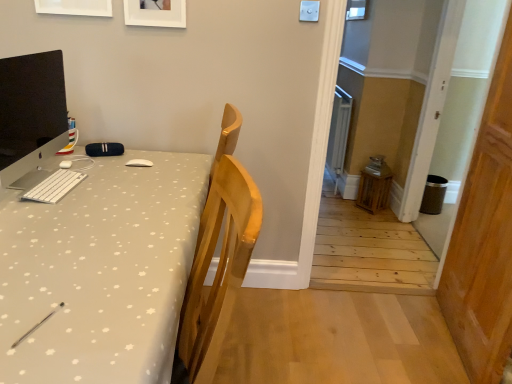
You are a GUI agent. You are given a task and a screenshot of the screen. Output one action in this format:
    pyautogui.click(x=<x>, y=<y>)
    Task: Click on the white matte keyboard at left
    This screenshot has height=384, width=512.
    Given the screenshot: What is the action you would take?
    pyautogui.click(x=54, y=186)

What do you see at coordinates (484, 238) in the screenshot? I see `wooden door at right` at bounding box center [484, 238].

What are the coordinates of `wooden door at right` in the screenshot? It's located at (484, 238).

The width and height of the screenshot is (512, 384). Identify the location of matte black monitor at left. (30, 111).

This screenshot has height=384, width=512. What do you see at coordinates (155, 13) in the screenshot?
I see `white matte picture frame at upper center, which is counted as the first picture frame, starting from the right` at bounding box center [155, 13].

Locate an element on the screen. white fabric desk at left is located at coordinates point(101,272).

This screenshot has width=512, height=384. I want to click on white matte picture frame at upper center, the first picture frame from the left, so click(75, 7).

Is matte black monitor at left located outside white matte picture frame at upper center, arranged as the second picture frame when viewed from the right?

Yes.

Between matte black monitor at left and white matte picture frame at upper center, arranged as the second picture frame when viewed from the right, which one is positioned behind?

white matte picture frame at upper center, arranged as the second picture frame when viewed from the right.

Which point is more distant from viewer, [6,75] or [95,3]?

The point [95,3] is farther from the camera.

Would you say matte black monitor at left is to the left or to the right of white matte picture frame at upper center, arranged as the second picture frame when viewed from the right, in the picture?

Based on their positions, matte black monitor at left is located to the left of white matte picture frame at upper center, arranged as the second picture frame when viewed from the right.

How many degrees apart are the facing directions of matte black monitor at left and white fabric desk at left?

Result: The angular difference between matte black monitor at left and white fabric desk at left is 90 degrees.

This screenshot has width=512, height=384. Find the location of `computer monitor lying behind the white fabric desk at left`. computer monitor lying behind the white fabric desk at left is located at coordinates (30, 111).

From a real-world perspective, between matte black monitor at left and white fabric desk at left, who is vertically higher?

matte black monitor at left is physically above.

Does point (33, 148) come farther from viewer compared to point (64, 212)?

Yes, point (33, 148) is farther from viewer.

Considering the sizes of objects white matte picture frame at upper center, which is counted as the first picture frame, starting from the right, and matte black monitor at left in the image provided, who is smaller, white matte picture frame at upper center, which is counted as the first picture frame, starting from the right, or matte black monitor at left?

With smaller size is white matte picture frame at upper center, which is counted as the first picture frame, starting from the right.

From the image's perspective, is white matte picture frame at upper center, which appears as the 2th picture frame when viewed from the left, located above or below matte black monitor at left?

From the image's perspective, white matte picture frame at upper center, which appears as the 2th picture frame when viewed from the left, appears above matte black monitor at left.

What's the angular difference between white matte picture frame at upper center, which appears as the 2th picture frame when viewed from the left, and matte black monitor at left's facing directions?

white matte picture frame at upper center, which appears as the 2th picture frame when viewed from the left, and matte black monitor at left are facing 90 degrees away from each other.

Does white matte keyboard at left have a greater width compared to wooden door at right?

No.

Is point (62, 175) positioned after point (473, 172)?

No, it is in front of (473, 172).

Which of these two, white matte keyboard at left or wooden door at right, is smaller?

Smaller between the two is white matte keyboard at left.

Relative to wooden door at right, is white matte keyboard at left in front or behind?

Clearly, white matte keyboard at left is behind wooden door at right.

Identify the location of the 2nd picture frame counting from the left of the wooden door at right. Image resolution: width=512 pixels, height=384 pixels. (75, 7).

Which is closer, [463,360] or [98,4]?

The point [98,4] is in front.

From the image's perspective, is wooden door at right beneath white matte picture frame at upper center, the first picture frame from the left?

Correct, wooden door at right appears lower than white matte picture frame at upper center, the first picture frame from the left, in the image.

Based on their positions, is white matte picture frame at upper center, arranged as the second picture frame when viewed from the right, located to the left or right of white matte keyboard at left?

Clearly, white matte picture frame at upper center, arranged as the second picture frame when viewed from the right, is on the left of white matte keyboard at left in the image.

Is white matte picture frame at upper center, the first picture frame from the left, closer to camera compared to white matte keyboard at left?

No, the depth of white matte picture frame at upper center, the first picture frame from the left, is greater than that of white matte keyboard at left.

From a real-world perspective, which is physically above, white matte picture frame at upper center, the first picture frame from the left, or white matte keyboard at left?

white matte picture frame at upper center, the first picture frame from the left.

Is white fabric desk at left wider than white matte keyboard at left?

Yes.

Locate an element on the screen. The image size is (512, 384). keyboard above the white fabric desk at left (from a real-world perspective) is located at coordinates (54, 186).

From the image's perspective, starting from the matte black monitor at left, which picture frame is the 2nd one above? Please provide its 2D coordinates.

[(75, 7)]

Where is `desk that appears on the right of matte black monitor at left`? The width and height of the screenshot is (512, 384). desk that appears on the right of matte black monitor at left is located at coordinates (101, 272).

Looking at the image, which one is located closer to matte black monitor at left, white matte picture frame at upper center, which appears as the 2th picture frame when viewed from the left, or wooden door at right?

Among the two, white matte picture frame at upper center, which appears as the 2th picture frame when viewed from the left, is located nearer to matte black monitor at left.

When comparing their distances from white matte picture frame at upper center, the first picture frame from the left, does white fabric desk at left or matte black monitor at left seem closer?

matte black monitor at left is closer to white matte picture frame at upper center, the first picture frame from the left.

Considering their positions, is matte black monitor at left positioned further to white matte picture frame at upper center, which appears as the 2th picture frame when viewed from the left, than white matte keyboard at left?

white matte keyboard at left is positioned further to the anchor white matte picture frame at upper center, which appears as the 2th picture frame when viewed from the left.

Which object lies nearer to the anchor point white matte keyboard at left, white matte picture frame at upper center, the first picture frame from the left, or matte black monitor at left?

Among the two, matte black monitor at left is located nearer to white matte keyboard at left.

Which object lies nearer to the anchor point white matte picture frame at upper center, arranged as the second picture frame when viewed from the right, white fabric desk at left or wooden door at right?

white fabric desk at left.

Based on their spatial positions, is white matte picture frame at upper center, which appears as the 2th picture frame when viewed from the left, or wooden door at right further from white matte keyboard at left?

The object further to white matte keyboard at left is wooden door at right.

Which object lies further to the anchor point wooden door at right, matte black monitor at left or white matte picture frame at upper center, arranged as the second picture frame when viewed from the right?

Among the two, white matte picture frame at upper center, arranged as the second picture frame when viewed from the right, is located further to wooden door at right.

Which object lies nearer to the anchor point white matte keyboard at left, white fabric desk at left or white matte picture frame at upper center, which appears as the 2th picture frame when viewed from the left?

The object closer to white matte keyboard at left is white fabric desk at left.

Identify the location of picture frame between white matte picture frame at upper center, the first picture frame from the left, and white fabric desk at left from top to bottom. (155, 13).

Where is `picture frame situated between white fabric desk at left and wooden door at right from left to right`? The image size is (512, 384). picture frame situated between white fabric desk at left and wooden door at right from left to right is located at coordinates (155, 13).

Find the location of a particular element. Image resolution: width=512 pixels, height=384 pixels. desk between white matte picture frame at upper center, arranged as the second picture frame when viewed from the right, and wooden door at right is located at coordinates (101, 272).

The width and height of the screenshot is (512, 384). Find the location of `computer monitor between white matte picture frame at upper center, the first picture frame from the left, and white matte keyboard at left vertically`. computer monitor between white matte picture frame at upper center, the first picture frame from the left, and white matte keyboard at left vertically is located at coordinates (30, 111).